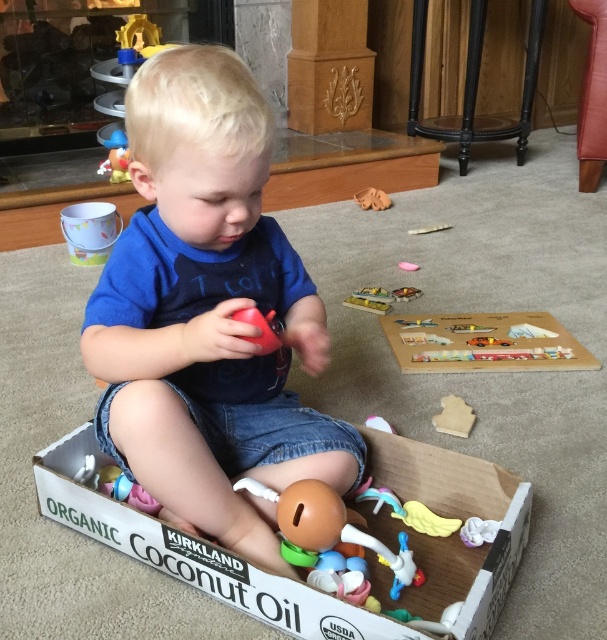
Question: Which of these objects is positioned closest to the wooden puzzle board at center?

Choices:
 (A) blue matte shirt at center
 (B) yellow rubber duck at center
 (C) white fabric toy at lower right
 (D) brown fabric toy at center

Answer: (B)

Question: Which point is farther to the camera?

Choices:
 (A) wooden puzzle board at center
 (B) white fabric toy at lower right
 (C) yellow rubber duck at center
 (D) rubberized plastic ball at center

Answer: (A)

Question: Which point is closer to the camera taking this photo?

Choices:
 (A) (429, 534)
 (B) (164, 403)
 (C) (367, 188)

Answer: (B)

Question: Does yellow rubber duck at center have a smaller size compared to rubberized plastic ball at center?

Choices:
 (A) no
 (B) yes

Answer: (B)

Question: Does white fabric toy at lower right have a smaller size compared to brown fabric toy at center?

Choices:
 (A) no
 (B) yes

Answer: (B)

Question: Considering the relative positions of rubberized plastic toy at lower center and yellow rubber duck at center in the image provided, where is rubberized plastic toy at lower center located with respect to yellow rubber duck at center?

Choices:
 (A) below
 (B) above

Answer: (B)